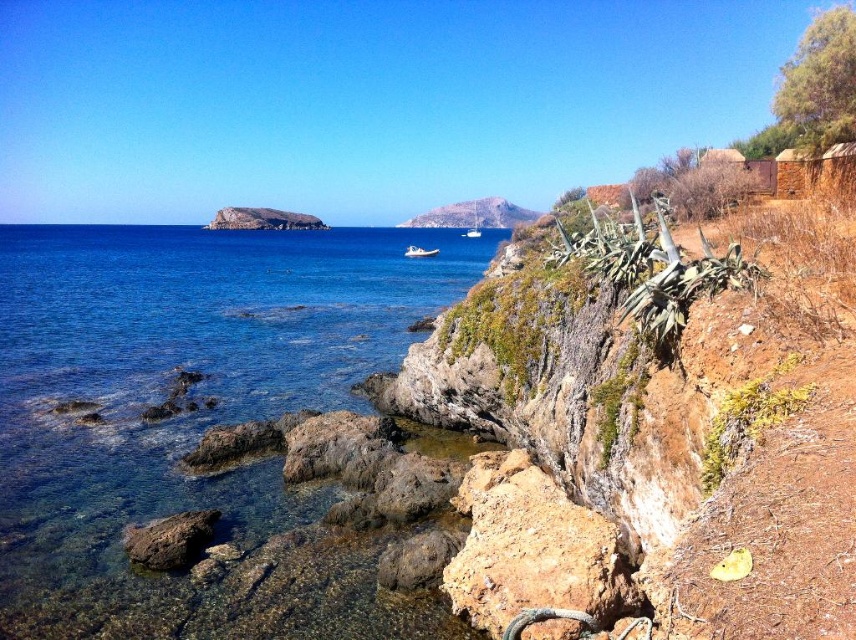
Is point (119, 291) positioned behind point (516, 545)?

Yes.

From the picture: Who is more forward, (401, 292) or (473, 506)?

Positioned in front is point (473, 506).

Identify the location of clear blue water at center. (192, 413).

Does brown rough rock at lower left have a smaller size compared to white rubber boat at center?

Indeed, brown rough rock at lower left has a smaller size compared to white rubber boat at center.

Is brown rough rock at lower left in front of white rubber boat at center?

Yes, it is.

The image size is (856, 640). I want to click on brown rough rock at lower left, so click(x=170, y=540).

Is brown rough rock at lower center positioned before rustic stone cliff at center?

That is True.

Does point (483, 529) lie behind point (456, 225)?

No.

This screenshot has width=856, height=640. Identify the location of brown rough rock at lower center. (531, 548).